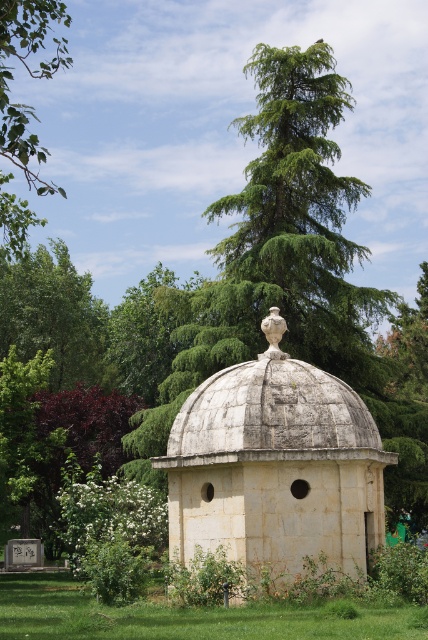
In the scene shown: You are planning to place a picnic blanket in this outdoor area. Considering the green leafy tree at center and the green grass at lower center, which area would provide more space for the blanket?

The green grass at lower center is narrower than the green leafy tree at center, so placing the picnic blanket under the green leafy tree at center would provide more space.

You are standing at the point marked by the coordinates point (296, 278) and want to walk towards the dome. Which direction should you go?

The green leafy tree at center is represented by point (296, 278). Since the dome is at the center of the scene, you should walk towards the center to reach the dome.